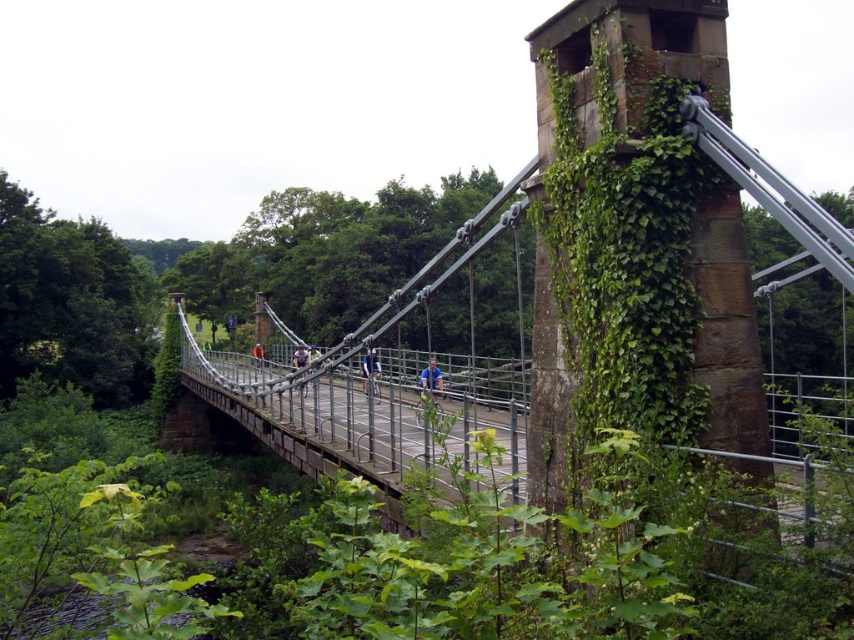
Between blue fabric jacket at center and orange fabric jacket at center, which one has more height?

blue fabric jacket at center

Is blue fabric jacket at center taller than orange fabric jacket at center?

Correct, blue fabric jacket at center is much taller as orange fabric jacket at center.

Does point (420, 394) come in front of point (252, 349)?

That is True.

The image size is (854, 640). What are the coordinates of `blue fabric jacket at center` in the screenshot? It's located at (430, 381).

Does point (428, 362) lie in front of point (376, 380)?

No, it is behind (376, 380).

Which is more to the right, blue fabric jacket at center or metallic silver bicycle at center?

blue fabric jacket at center

I want to click on blue fabric jacket at center, so click(430, 381).

Who is positioned more to the right, metallic gray bridge at center or orange fabric jacket at center?

metallic gray bridge at center

Find the location of a particular element. This screenshot has height=640, width=854. metallic gray bridge at center is located at coordinates (340, 416).

This screenshot has height=640, width=854. Identify the location of metallic gray bridge at center. (340, 416).